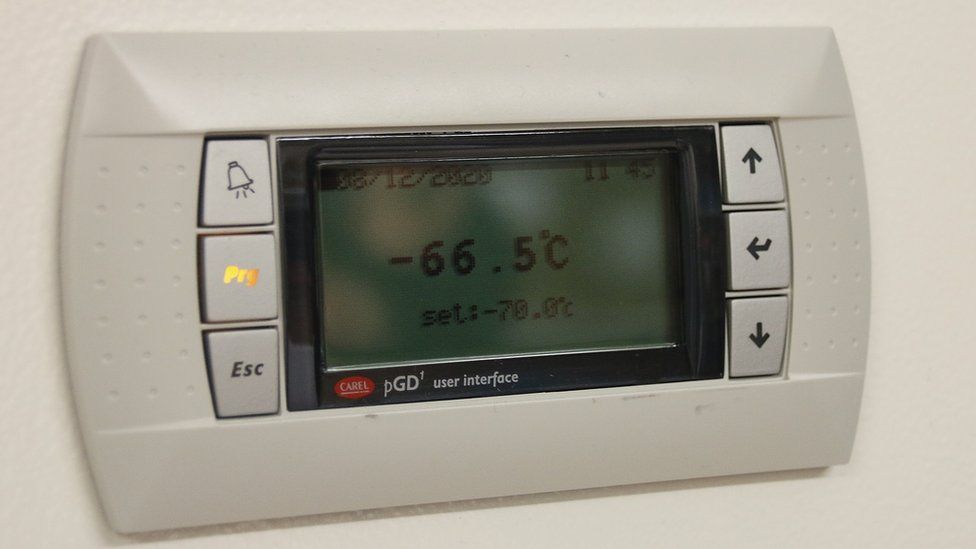
Find the location of a particular element. wall is located at coordinates (905, 63).